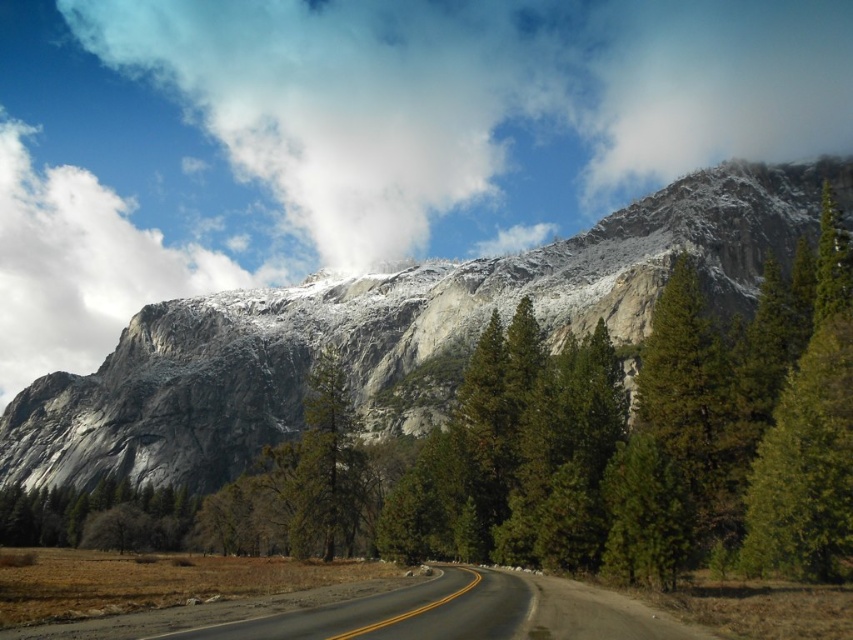
Question: Which point appears farthest from the camera in this image?

Choices:
 (A) (251, 294)
 (B) (62, 214)
 (C) (347, 484)
 (D) (306, 625)

Answer: (B)

Question: Which of the following is the farthest from the observer?

Choices:
 (A) click(x=503, y=300)
 (B) click(x=283, y=632)
 (C) click(x=10, y=241)

Answer: (C)

Question: Is gray/rocky mountain at upper center to the left of asphalt road at lower center from the viewer's perspective?

Choices:
 (A) no
 (B) yes

Answer: (B)

Question: Which of the following is the closest to the observer?

Choices:
 (A) tap(292, 529)
 (B) tap(347, 595)
 (C) tap(138, 230)

Answer: (B)

Question: Can you confirm if asphalt road at lower center is positioned above green matte tree at center?

Choices:
 (A) no
 (B) yes

Answer: (A)

Question: Is gray/rocky mountain at upper center positioned at the back of asphalt road at lower center?

Choices:
 (A) yes
 (B) no

Answer: (A)